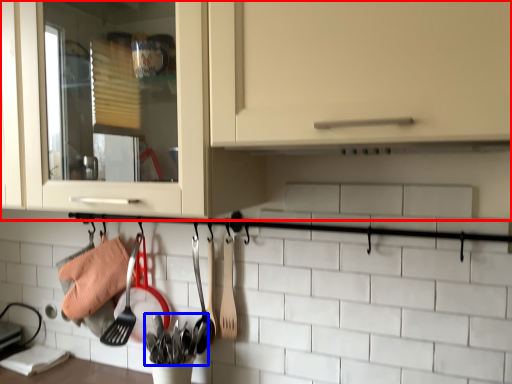
Question: Which point is closer to the camera, cabinetry (highlighted by a red box) or silverware (highlighted by a blue box)?

Choices:
 (A) cabinetry
 (B) silverware

Answer: (A)